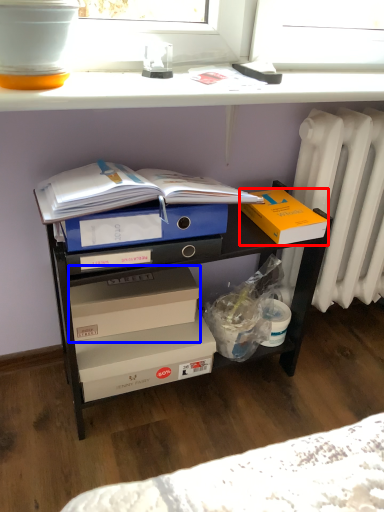
Question: Which object is closer to the camera taking this photo, box (highlighted by a red box) or box (highlighted by a blue box)?

Choices:
 (A) box
 (B) box

Answer: (A)